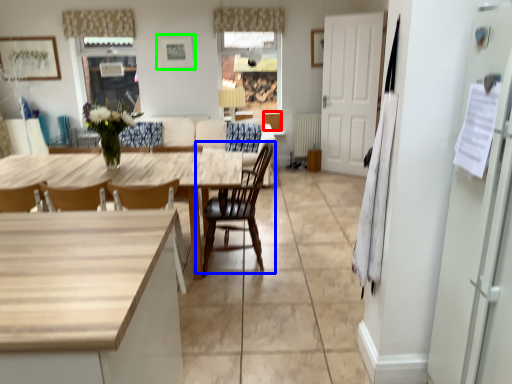
Question: Which object is the closest to the cabinetry (highlighted by a red box)? Choose among these: chair (highlighted by a blue box) or picture frame (highlighted by a green box).

Choices:
 (A) chair
 (B) picture frame

Answer: (B)